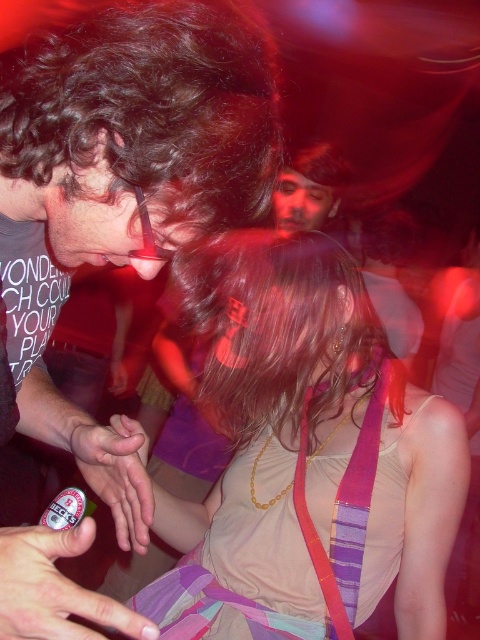
Locate an element on the screen. The height and width of the screenshot is (640, 480). purple striped strap at center is located at coordinates (343, 513).

Between purple striped strap at center and matte skin hand at center, which one is positioned higher?

matte skin hand at center

The image size is (480, 640). I want to click on purple striped strap at center, so click(343, 513).

Between point (402, 387) and point (351, 628), which one is positioned in front?

Point (351, 628) is in front.

The height and width of the screenshot is (640, 480). What are the coordinates of `matte beige tank top at center` in the screenshot? It's located at (312, 432).

Which is more to the left, metallic silver ring at lower left or matte skin hand at center?

From the viewer's perspective, matte skin hand at center appears more on the left side.

Is point (118, 604) behind point (118, 524)?

No, (118, 604) is closer to viewer.

Identify the location of metallic silver ring at lower left. This screenshot has width=480, height=640. (55, 588).